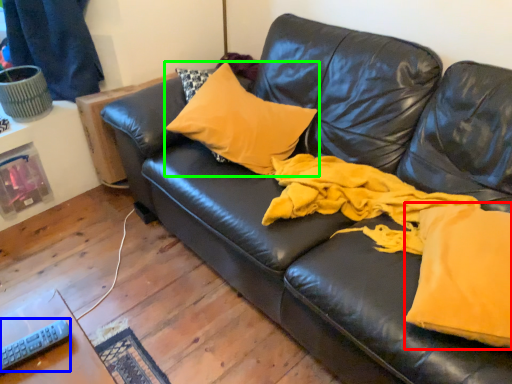
Question: Based on their relative distances, which object is farther from fabric (highlighted by a red box)? Choose from remote (highlighted by a blue box) and pillow (highlighted by a green box).

Choices:
 (A) remote
 (B) pillow

Answer: (A)